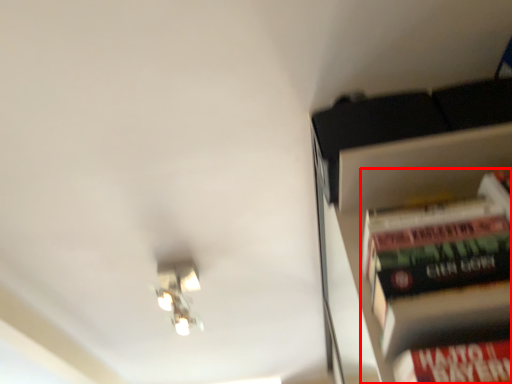
Question: From the image's perspective, what is the correct spatial relationship of book (annotated by the red box) in relation to light fixture?

Choices:
 (A) below
 (B) above

Answer: (B)